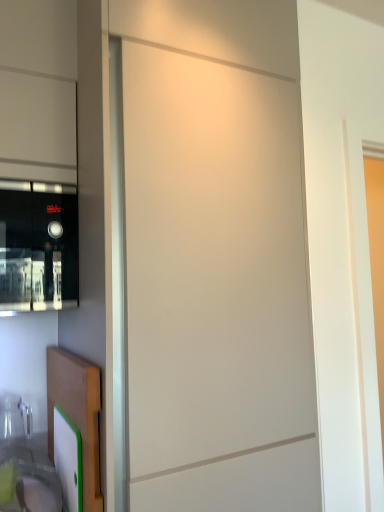
Question: Is translucent plastic sink at lower left thinner than black glass microwave at left?

Choices:
 (A) yes
 (B) no

Answer: (A)

Question: Is translucent plastic sink at lower left oriented towards black glass microwave at left?

Choices:
 (A) no
 (B) yes

Answer: (A)

Question: Is translucent plastic sink at lower left shorter than black glass microwave at left?

Choices:
 (A) yes
 (B) no

Answer: (A)

Question: Can we say translucent plastic sink at lower left lies outside black glass microwave at left?

Choices:
 (A) no
 (B) yes

Answer: (B)

Question: From the image's perspective, is translucent plastic sink at lower left on top of black glass microwave at left?

Choices:
 (A) no
 (B) yes

Answer: (A)

Question: Considering the positions of translucent plastic sink at lower left and matte white screen door at center in the image, is translucent plastic sink at lower left wider or thinner than matte white screen door at center?

Choices:
 (A) thin
 (B) wide

Answer: (A)

Question: In terms of size, does translucent plastic sink at lower left appear bigger or smaller than matte white screen door at center?

Choices:
 (A) big
 (B) small

Answer: (B)

Question: Do you think translucent plastic sink at lower left is within matte white screen door at center, or outside of it?

Choices:
 (A) inside
 (B) outside

Answer: (B)

Question: In the image, is translucent plastic sink at lower left positioned in front of or behind matte white screen door at center?

Choices:
 (A) behind
 (B) front

Answer: (B)

Question: From the image's perspective, is black glass microwave at left located above or below translucent plastic sink at lower left?

Choices:
 (A) above
 (B) below

Answer: (A)

Question: Is point (64, 246) closer or farther from the camera than point (28, 501)?

Choices:
 (A) farther
 (B) closer

Answer: (A)

Question: Based on their positions, is black glass microwave at left located to the left or right of translucent plastic sink at lower left?

Choices:
 (A) left
 (B) right

Answer: (A)

Question: In the image, is black glass microwave at left positioned in front of or behind translucent plastic sink at lower left?

Choices:
 (A) front
 (B) behind

Answer: (B)

Question: Relative to black glass microwave at left, is matte white screen door at center in front or behind?

Choices:
 (A) behind
 (B) front

Answer: (B)

Question: Visually, is matte white screen door at center positioned to the left or to the right of black glass microwave at left?

Choices:
 (A) left
 (B) right

Answer: (B)